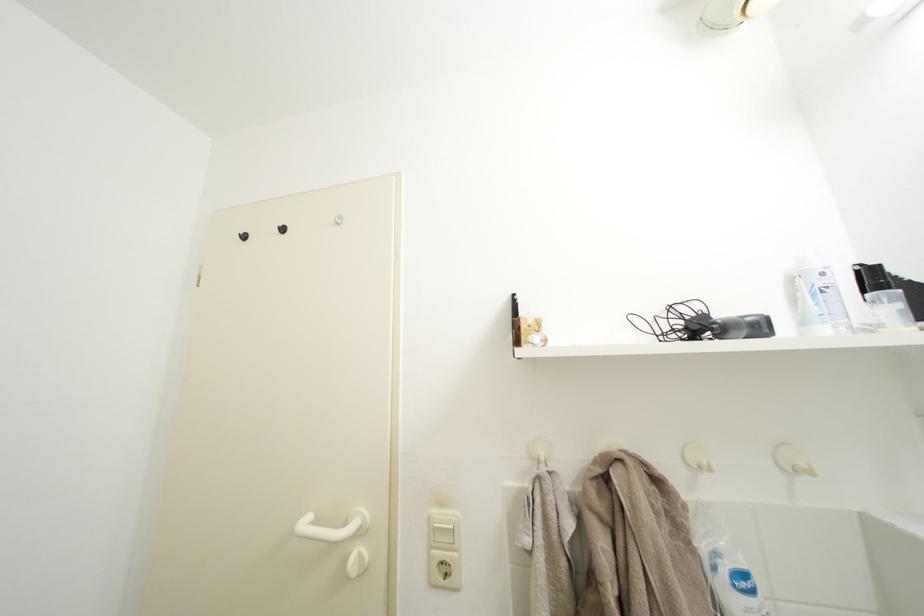
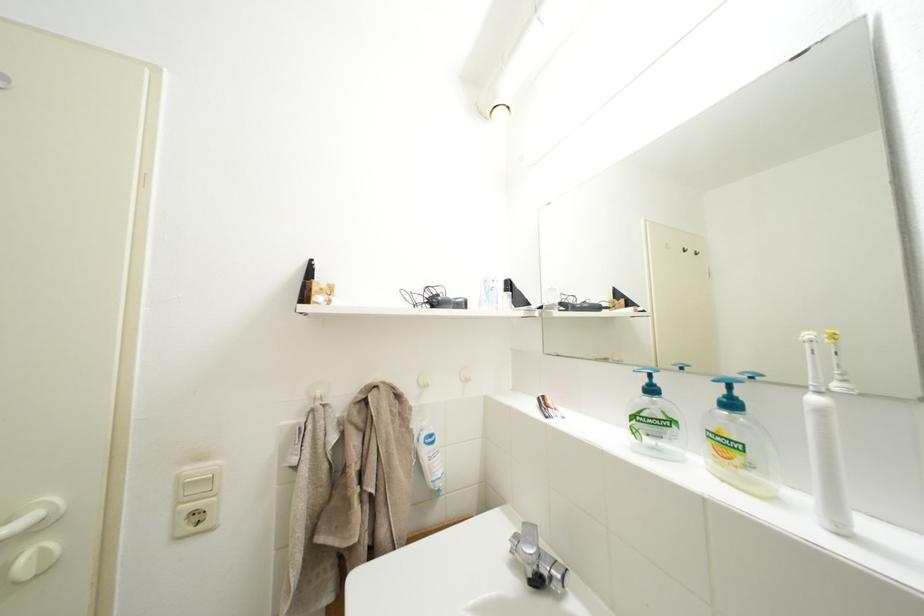
Where in the second image is the point corresponding to pixel 445 517 from the first image?

(200, 475)